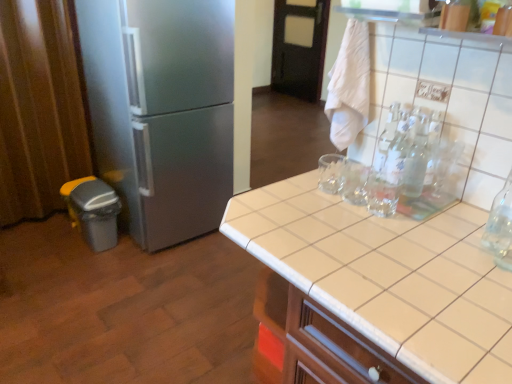
Measure the distance between point (96, 8) and camera.

Point (96, 8) and camera are 2.06 meters apart from each other.

Image resolution: width=512 pixels, height=384 pixels. What do you see at coordinates (162, 111) in the screenshot?
I see `satin silver refrigerator at left` at bounding box center [162, 111].

Where is `clear glass bottle at upper right`? clear glass bottle at upper right is located at coordinates (411, 155).

Describe the element at coordinates (298, 48) in the screenshot. I see `black wood door at upper center` at that location.

Identify the location of satin silver refrigerator at left. Image resolution: width=512 pixels, height=384 pixels. (162, 111).

From the picture: From the image's perspective, which is above, clear glass bottle at upper right or brown fabric curtain at left?

brown fabric curtain at left, from the image's perspective.

Is clear glass bottle at upper right further to the viewer compared to brown fabric curtain at left?

No.

From a real-world perspective, is clear glass bottle at upper right above or below brown fabric curtain at left?

From a real-world perspective, clear glass bottle at upper right is physically above brown fabric curtain at left.

Is the position of black wood door at upper center more distant than that of white tile countertop at center?

That is True.

Can you confirm if black wood door at upper center is taller than white tile countertop at center?

Correct, black wood door at upper center is much taller as white tile countertop at center.

From the image's perspective, who appears lower, black wood door at upper center or white tile countertop at center?

white tile countertop at center.

Could you tell me if black wood door at upper center is facing white tile countertop at center?

No.

Identify the location of refrigerator positioned vertically above the black wood door at upper center (from a real-world perspective). The height and width of the screenshot is (384, 512). (162, 111).

Would you consider black wood door at upper center to be distant from satin silver refrigerator at left?

Yes, black wood door at upper center is far from satin silver refrigerator at left.

Considering the relative sizes of black wood door at upper center and satin silver refrigerator at left in the image provided, is black wood door at upper center smaller than satin silver refrigerator at left?

Correct, black wood door at upper center occupies less space than satin silver refrigerator at left.

Is brown fabric curtain at left surrounding satin silver refrigerator at left?

No.

From a real-world perspective, which is physically below, brown fabric curtain at left or satin silver refrigerator at left?

brown fabric curtain at left.

This screenshot has width=512, height=384. In the image, there is a satin silver refrigerator at left. What are the coordinates of `curtain below it (from the image's perspective)` in the screenshot? It's located at (40, 108).

Does brown fabric curtain at left turn towards clear glass bottle at upper right?

Yes, brown fabric curtain at left is oriented towards clear glass bottle at upper right.

Where is `bottle above the brown fabric curtain at left (from a real-world perspective)`? This screenshot has width=512, height=384. bottle above the brown fabric curtain at left (from a real-world perspective) is located at coordinates (411, 155).

Is brown fabric curtain at left completely or partially outside of clear glass bottle at upper right?

brown fabric curtain at left is positioned outside clear glass bottle at upper right.

From the picture: Is brown fabric curtain at left smaller than clear glass bottle at upper right?

Actually, brown fabric curtain at left might be larger than clear glass bottle at upper right.

Is satin silver refrigerator at left aimed at clear glass bottle at upper right?

Yes, satin silver refrigerator at left is facing clear glass bottle at upper right.

Is satin silver refrigerator at left wider or thinner than clear glass bottle at upper right?

In the image, satin silver refrigerator at left appears to be wider than clear glass bottle at upper right.

Does point (135, 81) appear closer or farther from the camera than point (419, 176)?

Point (135, 81) is farther from the camera than point (419, 176).

Is satin silver refrigerator at left placed right next to clear glass bottle at upper right?

They are not placed beside each other.

Is clear glass bottle at upper right facing towards black wood door at upper center?

No, clear glass bottle at upper right is not aimed at black wood door at upper center.

Is clear glass bottle at upper right thinner than black wood door at upper center?

In fact, clear glass bottle at upper right might be wider than black wood door at upper center.

Which is further, [391,168] or [275,66]?

The point [275,66] is more distant.

Based on the photo, is clear glass bottle at upper right directly adjacent to black wood door at upper center?

They are not placed beside each other.

The height and width of the screenshot is (384, 512). In order to click on bottle on the right of brown fabric curtain at left in this screenshot , I will do `click(411, 155)`.

Where is `door located above the white tile countertop at center (from a real-world perspective)`? door located above the white tile countertop at center (from a real-world perspective) is located at coordinates (298, 48).

From the image, which object appears to be farther from clear glass bottle at upper right, black wood door at upper center or white tile countertop at center?

The object further to clear glass bottle at upper right is black wood door at upper center.

From the image, which object appears to be nearer to satin silver refrigerator at left, brown fabric curtain at left or clear glass bottle at upper right?

brown fabric curtain at left lies closer to satin silver refrigerator at left than the other object.

Looking at the image, which one is located closer to brown fabric curtain at left, clear glass bottle at upper right or white tile countertop at center?

The object closer to brown fabric curtain at left is white tile countertop at center.

Which object lies further to the anchor point satin silver refrigerator at left, black wood door at upper center or brown fabric curtain at left?

Among the two, black wood door at upper center is located further to satin silver refrigerator at left.

Estimate the real-world distances between objects in this image. Which object is further from clear glass bottle at upper right, white tile countertop at center or brown fabric curtain at left?

brown fabric curtain at left is further to clear glass bottle at upper right.

Based on their spatial positions, is black wood door at upper center or satin silver refrigerator at left closer to clear glass bottle at upper right?

satin silver refrigerator at left is positioned closer to the anchor clear glass bottle at upper right.

Based on the photo, estimate the real-world distances between objects in this image. Which object is closer to satin silver refrigerator at left, white tile countertop at center or brown fabric curtain at left?

The object closer to satin silver refrigerator at left is brown fabric curtain at left.

Based on their spatial positions, is satin silver refrigerator at left or white tile countertop at center closer to clear glass bottle at upper right?

Among the two, white tile countertop at center is located nearer to clear glass bottle at upper right.

Locate an element on the screen. bottle between white tile countertop at center and black wood door at upper center from front to back is located at coordinates (411, 155).

Find the location of a particular element. curtain positioned between satin silver refrigerator at left and black wood door at upper center from near to far is located at coordinates (40, 108).

In order to click on refrigerator located between clear glass bottle at upper right and black wood door at upper center in the depth direction in this screenshot , I will do `click(162, 111)`.

You are a GUI agent. You are given a task and a screenshot of the screen. Output one action in this format:
    pyautogui.click(x=<x>, y=<y>)
    Task: Click on the curtain between clear glass bottle at upper right and black wood door at upper center along the z-axis
    This screenshot has height=384, width=512.
    Given the screenshot: What is the action you would take?
    pyautogui.click(x=40, y=108)